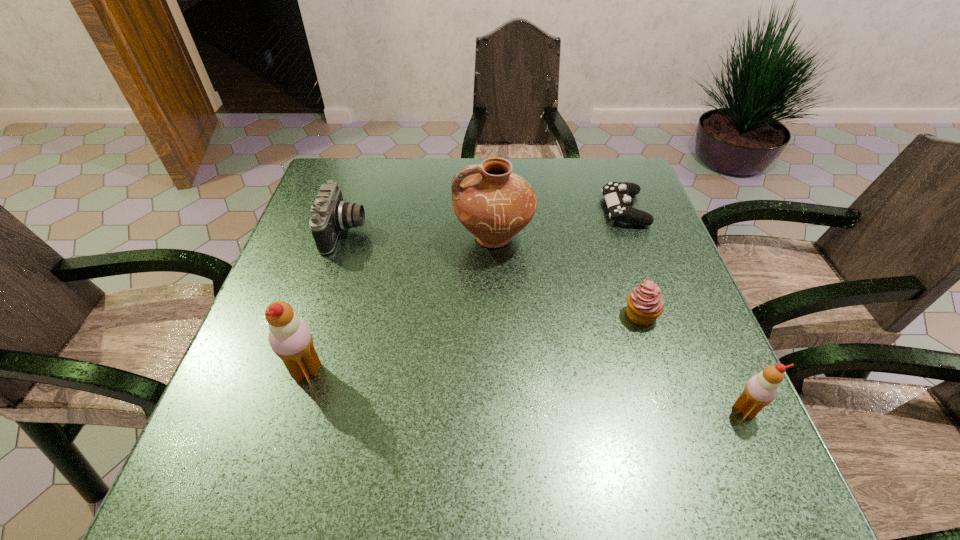
If we want them evenly spaced by inserting an extra icecream among them, please locate a free spot for this new icecream. Please provide its 2D coordinates. Your answer should be formatted as a tuple, i.e. [(x, y)], where the tuple contains the x and y coordinates of a point satisfying the conditions above.

[(518, 390)]